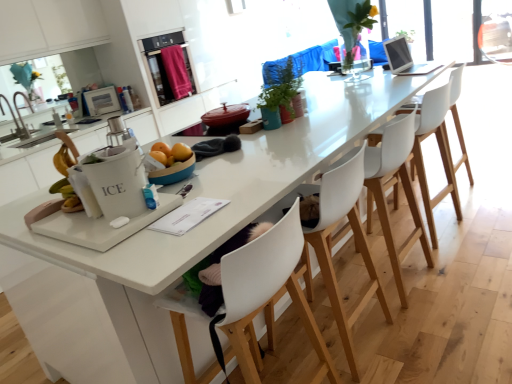
Question: Is white plastic chair at center, which is the 3th chair from back to front, surrounded by brushed metal faucet at left?

Choices:
 (A) yes
 (B) no

Answer: (B)

Question: Does brushed metal faucet at left have a greater height compared to white plastic chair at center, which is the 3th chair from back to front?

Choices:
 (A) no
 (B) yes

Answer: (A)

Question: Does brushed metal faucet at left touch white plastic chair at center, which is the 3th chair from back to front?

Choices:
 (A) yes
 (B) no

Answer: (B)

Question: From a real-world perspective, does brushed metal faucet at left stand above white plastic chair at center, positioned as the 3th chair in front-to-back order?

Choices:
 (A) no
 (B) yes

Answer: (B)

Question: Can you confirm if brushed metal faucet at left is bigger than white plastic chair at center, which is the 3th chair from back to front?

Choices:
 (A) yes
 (B) no

Answer: (B)

Question: Based on their positions, is white plastic chair at center, positioned as the 3th chair in front-to-back order, located to the left or right of brushed metal faucet at left?

Choices:
 (A) right
 (B) left

Answer: (A)

Question: In terms of size, does white plastic chair at center, positioned as the 3th chair in front-to-back order, appear bigger or smaller than brushed metal faucet at left?

Choices:
 (A) small
 (B) big

Answer: (B)

Question: Considering the positions of point (340, 160) and point (16, 135), is point (340, 160) closer or farther from the camera than point (16, 135)?

Choices:
 (A) closer
 (B) farther

Answer: (A)

Question: From their relative heights in the image, would you say white plastic chair at center, positioned as the 3th chair in front-to-back order, is taller or shorter than brushed metal faucet at left?

Choices:
 (A) tall
 (B) short

Answer: (A)

Question: Would you say white plastic chair at right, the 5th chair in the front-to-back sequence, is inside or outside white plastic chair at center, positioned as the 3th chair in front-to-back order?

Choices:
 (A) outside
 (B) inside

Answer: (A)

Question: From the image's perspective, is white plastic chair at right, placed as the first chair when sorted from back to front, located above or below white plastic chair at center, positioned as the 3th chair in front-to-back order?

Choices:
 (A) below
 (B) above

Answer: (B)

Question: Is white plastic chair at right, placed as the first chair when sorted from back to front, to the left or to the right of white plastic chair at center, positioned as the 3th chair in front-to-back order, in the image?

Choices:
 (A) right
 (B) left

Answer: (A)

Question: From a real-world perspective, relative to white plastic chair at center, which is the 3th chair from back to front, is white plastic chair at right, the 5th chair in the front-to-back sequence, vertically above or below?

Choices:
 (A) below
 (B) above

Answer: (A)

Question: Do you think white matte ice bucket at center, which ranks as the second appliance in left-to-right order, is within white plastic chair at center, the 4th chair viewed from the front, or outside of it?

Choices:
 (A) outside
 (B) inside

Answer: (A)

Question: Does point (122, 211) appear closer or farther from the camera than point (442, 120)?

Choices:
 (A) farther
 (B) closer

Answer: (B)